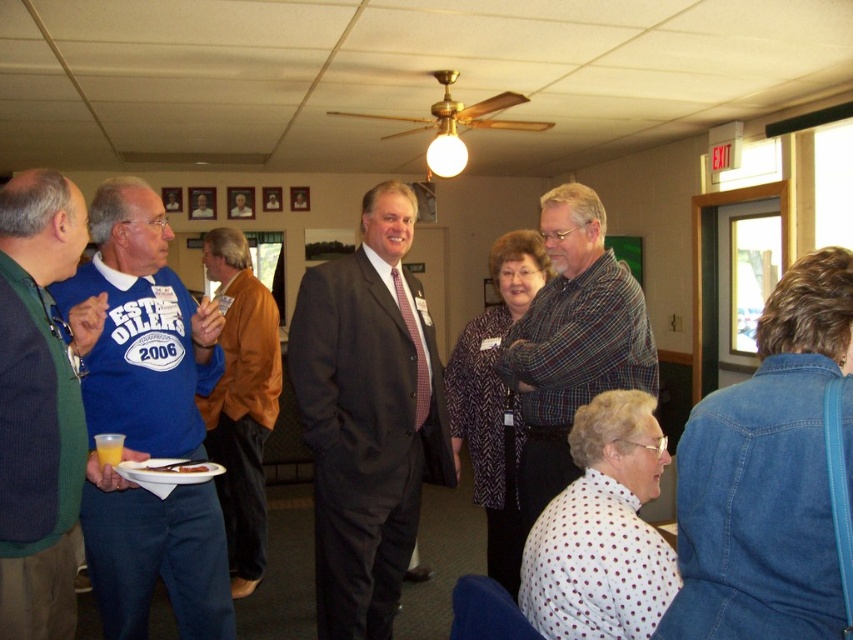
Question: Can you confirm if blue cotton shirt at left is positioned above orange leather jacket at center?

Choices:
 (A) no
 (B) yes

Answer: (B)

Question: Can you confirm if plaid shirt at center is positioned to the left of orange leather jacket at center?

Choices:
 (A) yes
 (B) no

Answer: (B)

Question: Which point is closer to the camera taking this photo?

Choices:
 (A) (225, 456)
 (B) (318, 488)
 (C) (125, 276)

Answer: (C)

Question: Does dark gray suit at center appear over blue cotton shirt at left?

Choices:
 (A) yes
 (B) no

Answer: (B)

Question: Based on their relative distances, which object is nearer to the plaid shirt at center?

Choices:
 (A) green wool sweater at left
 (B) dark gray suit at center
 (C) blue cotton shirt at left

Answer: (B)

Question: Which object appears farthest from the camera in this image?

Choices:
 (A) dark gray suit at center
 (B) blue cotton shirt at left
 (C) plaid shirt at center
 (D) green wool sweater at left

Answer: (A)